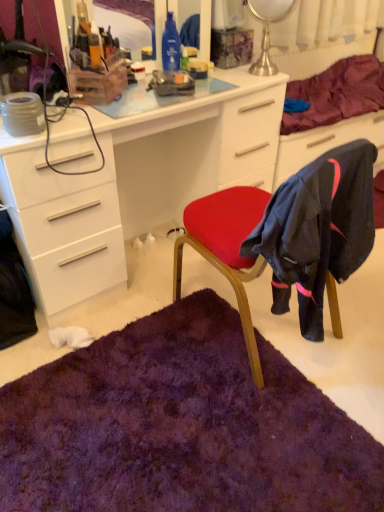
Question: From the image's perspective, is purple soft fabric at upper right beneath purple shaggy rug at lower center?

Choices:
 (A) yes
 (B) no

Answer: (B)

Question: Considering the relative sizes of purple soft fabric at upper right and purple shaggy rug at lower center in the image provided, is purple soft fabric at upper right taller than purple shaggy rug at lower center?

Choices:
 (A) yes
 (B) no

Answer: (A)

Question: Considering the relative sizes of purple soft fabric at upper right and purple shaggy rug at lower center in the image provided, is purple soft fabric at upper right thinner than purple shaggy rug at lower center?

Choices:
 (A) no
 (B) yes

Answer: (B)

Question: Is purple soft fabric at upper right at the left side of purple shaggy rug at lower center?

Choices:
 (A) yes
 (B) no

Answer: (B)

Question: From a real-world perspective, is purple soft fabric at upper right on top of purple shaggy rug at lower center?

Choices:
 (A) no
 (B) yes

Answer: (B)

Question: From a real-world perspective, relative to purple shaggy rug at lower center, is clear plastic organizer at upper center vertically above or below?

Choices:
 (A) above
 (B) below

Answer: (A)

Question: Would you say clear plastic organizer at upper center is to the left or to the right of purple shaggy rug at lower center in the picture?

Choices:
 (A) left
 (B) right

Answer: (A)

Question: Do you think clear plastic organizer at upper center is within purple shaggy rug at lower center, or outside of it?

Choices:
 (A) inside
 (B) outside

Answer: (B)

Question: Considering the positions of clear plastic organizer at upper center and purple shaggy rug at lower center in the image, is clear plastic organizer at upper center bigger or smaller than purple shaggy rug at lower center?

Choices:
 (A) big
 (B) small

Answer: (B)

Question: Would you say purple shaggy rug at lower center is to the left or to the right of white glossy desk at center in the picture?

Choices:
 (A) right
 (B) left

Answer: (A)

Question: In the image, is purple shaggy rug at lower center positioned in front of or behind white glossy desk at center?

Choices:
 (A) behind
 (B) front

Answer: (B)

Question: Looking at the image, does purple shaggy rug at lower center seem bigger or smaller compared to white glossy desk at center?

Choices:
 (A) big
 (B) small

Answer: (B)

Question: From a real-world perspective, is purple shaggy rug at lower center above or below white glossy desk at center?

Choices:
 (A) below
 (B) above

Answer: (A)

Question: Is white glossy desk at center inside the boundaries of clear plastic organizer at upper center, or outside?

Choices:
 (A) inside
 (B) outside

Answer: (B)

Question: Is white glossy desk at center to the left or to the right of clear plastic organizer at upper center in the image?

Choices:
 (A) right
 (B) left

Answer: (A)